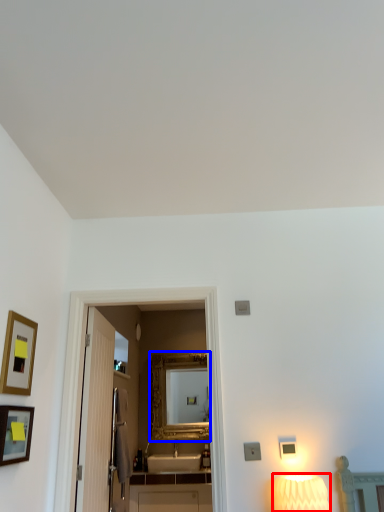
Question: Which of the following is the farthest to the observer, lamp (highlighted by a red box) or mirror (highlighted by a blue box)?

Choices:
 (A) lamp
 (B) mirror

Answer: (B)